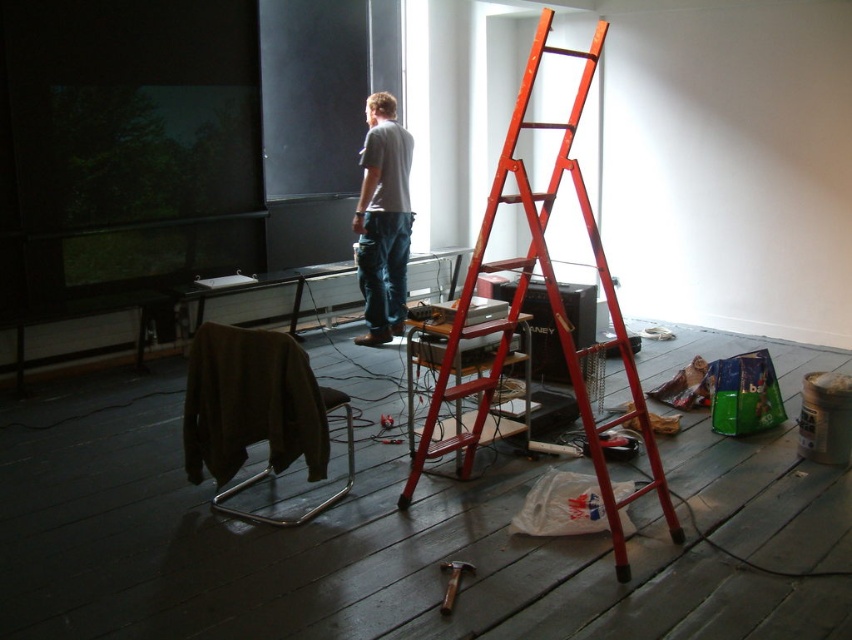
You are a worker in the room. You need to hang a picture on the wall. The picture frame is heavy, so you must choose between the gray cotton shirt at center and the wooden hammer at center to use as a makeshift weight to hold the frame in place temporarily. Which object should you choose and why?

You should choose the gray cotton shirt at center because it is taller than the wooden hammer at center, making it more stable and effective as a makeshift weight to hold the frame in place temporarily.

You are a contractor working in a room with a red ladder in the center. You need to reach both the gray cotton shirt at center and the wooden hammer at center. Which object is closer to you?

The gray cotton shirt at center is 10.24 feet away from the wooden hammer at center, so the distance between them is 10.24 feet. However, since both are at the center, their distance from you depends on your position. Without knowing your exact location, it is impossible to determine which is closer.